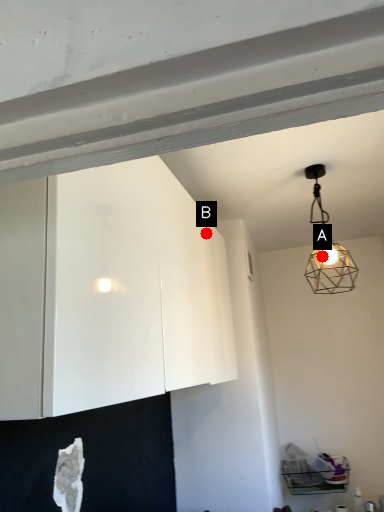
Question: Two points are circled on the image, labeled by A and B beside each circle. Which point is closer to the camera taking this photo?

Choices:
 (A) A is closer
 (B) B is closer

Answer: (B)